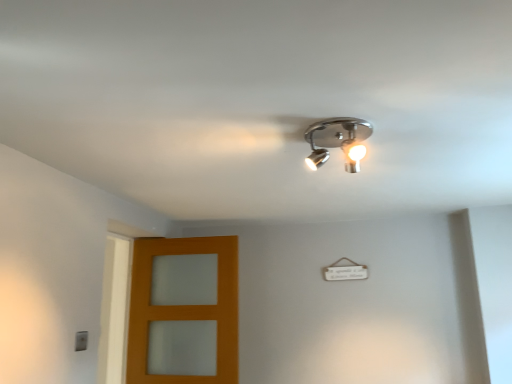
Question: From a real-world perspective, relative to orange wood door at lower left, is chrome/metallic spotlight at upper center vertically above or below?

Choices:
 (A) below
 (B) above

Answer: (B)

Question: Considering the positions of point (336, 132) and point (227, 382), is point (336, 132) closer or farther from the camera than point (227, 382)?

Choices:
 (A) closer
 (B) farther

Answer: (A)

Question: Would you say chrome/metallic spotlight at upper center is inside or outside orange wood door at lower left?

Choices:
 (A) outside
 (B) inside

Answer: (A)

Question: In terms of height, does orange wood door at lower left look taller or shorter compared to chrome/metallic spotlight at upper center?

Choices:
 (A) short
 (B) tall

Answer: (B)

Question: Is orange wood door at lower left to the left or to the right of chrome/metallic spotlight at upper center in the image?

Choices:
 (A) left
 (B) right

Answer: (A)

Question: In terms of size, does orange wood door at lower left appear bigger or smaller than chrome/metallic spotlight at upper center?

Choices:
 (A) small
 (B) big

Answer: (B)

Question: Is orange wood door at lower left spatially inside chrome/metallic spotlight at upper center, or outside of it?

Choices:
 (A) outside
 (B) inside

Answer: (A)